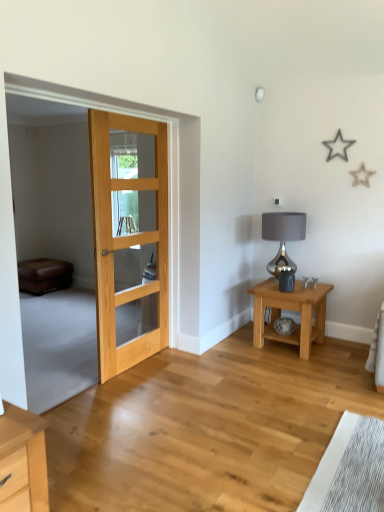
Where is `vacant area that lies between light brown wood nightstand at lower right and natural wood door at left`? The height and width of the screenshot is (512, 384). vacant area that lies between light brown wood nightstand at lower right and natural wood door at left is located at coordinates (213, 362).